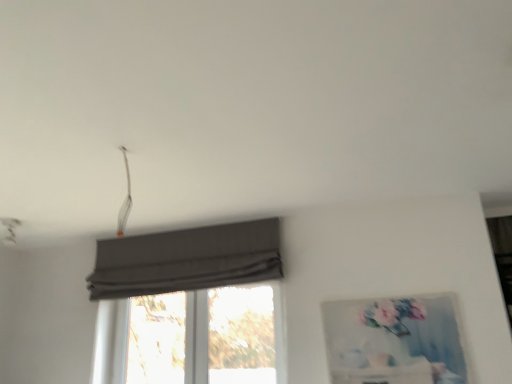
Question: From the image's perspective, is dark gray fabric curtain at center on transparent glass window at center?

Choices:
 (A) no
 (B) yes

Answer: (B)

Question: Does dark gray fabric curtain at center turn towards transparent glass window at center?

Choices:
 (A) no
 (B) yes

Answer: (A)

Question: Does dark gray fabric curtain at center have a smaller size compared to transparent glass window at center?

Choices:
 (A) no
 (B) yes

Answer: (A)

Question: Considering the relative sizes of dark gray fabric curtain at center and transparent glass window at center in the image provided, is dark gray fabric curtain at center shorter than transparent glass window at center?

Choices:
 (A) no
 (B) yes

Answer: (B)

Question: Does dark gray fabric curtain at center have a larger size compared to transparent glass window at center?

Choices:
 (A) no
 (B) yes

Answer: (B)

Question: Is matte gray picture frame at right bigger or smaller than transparent glass window at center?

Choices:
 (A) small
 (B) big

Answer: (A)

Question: From the image's perspective, relative to transparent glass window at center, is matte gray picture frame at right above or below?

Choices:
 (A) below
 (B) above

Answer: (B)

Question: Is point (424, 321) closer or farther from the camera than point (240, 306)?

Choices:
 (A) closer
 (B) farther

Answer: (A)

Question: Based on their positions, is matte gray picture frame at right located to the left or right of transparent glass window at center?

Choices:
 (A) left
 (B) right

Answer: (B)

Question: Is dark gray fabric curtain at center to the left or to the right of matte gray picture frame at right in the image?

Choices:
 (A) right
 (B) left

Answer: (B)

Question: From a real-world perspective, is dark gray fabric curtain at center physically located above or below matte gray picture frame at right?

Choices:
 (A) below
 (B) above

Answer: (B)

Question: Based on their sizes in the image, would you say dark gray fabric curtain at center is bigger or smaller than matte gray picture frame at right?

Choices:
 (A) small
 (B) big

Answer: (B)

Question: In terms of width, does dark gray fabric curtain at center look wider or thinner when compared to matte gray picture frame at right?

Choices:
 (A) thin
 (B) wide

Answer: (B)

Question: Is dark gray fabric curtain at center spatially inside transparent glass window at center, or outside of it?

Choices:
 (A) outside
 (B) inside

Answer: (A)

Question: Does point (146, 273) appear closer or farther from the camera than point (165, 309)?

Choices:
 (A) closer
 (B) farther

Answer: (A)